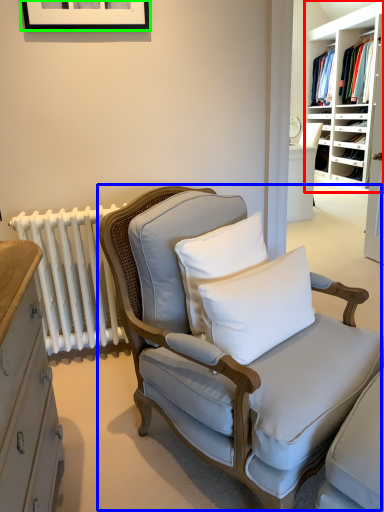
Question: Considering the real-world distances, which object is farthest from shelf (highlighted by a red box)? chair (highlighted by a blue box) or picture frame (highlighted by a green box)?

Choices:
 (A) chair
 (B) picture frame

Answer: (A)